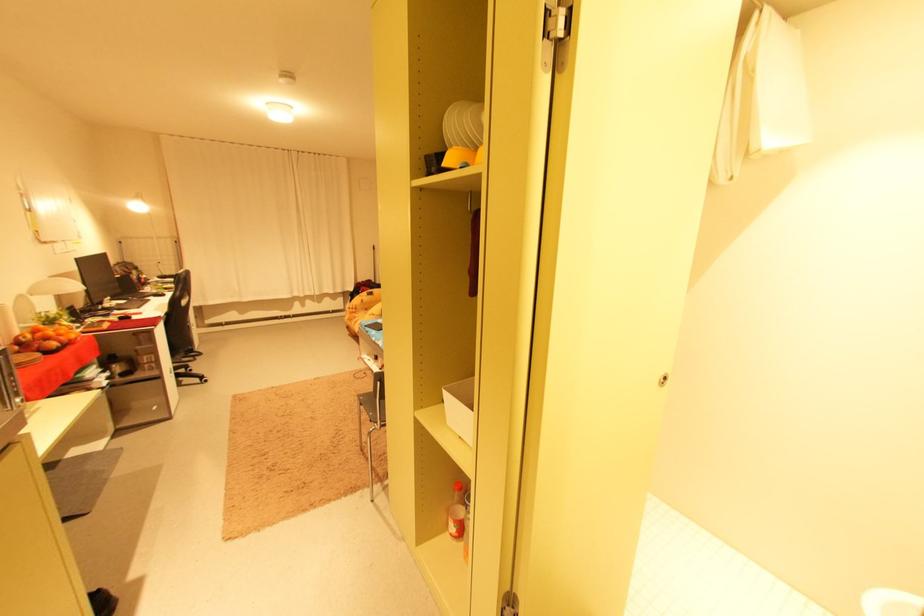
Describe the element at coordinates (560, 33) in the screenshot. The height and width of the screenshot is (616, 924). I see `a silver cabinet lock` at that location.